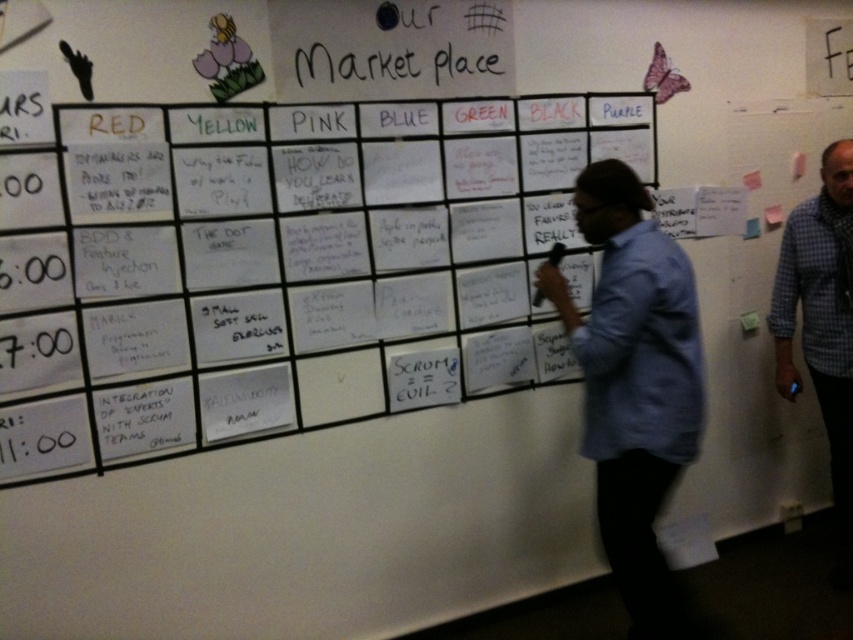
Is white paper at center positioned in front of blue shirt at center?

Yes, it is in front of blue shirt at center.

Is white paper at center to the right of blue shirt at center from the viewer's perspective?

Incorrect, white paper at center is not on the right side of blue shirt at center.

Find the location of a particular element. white paper at center is located at coordinates (280, 262).

Does white paper at center have a greater height compared to blue plaid shirt at right?

No, white paper at center is not taller than blue plaid shirt at right.

Is white paper at center wider than blue plaid shirt at right?

Correct, the width of white paper at center exceeds that of blue plaid shirt at right.

I want to click on white paper at center, so click(280, 262).

Does blue shirt at center appear under blue plaid shirt at right?

Correct, blue shirt at center is located below blue plaid shirt at right.

Between blue shirt at center and blue plaid shirt at right, which one has less height?

blue shirt at center is shorter.

Find the location of a particular element. blue shirt at center is located at coordinates (634, 385).